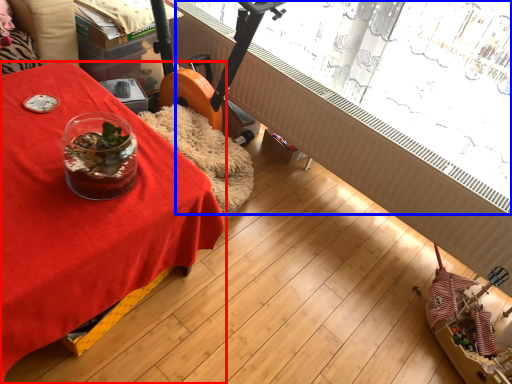
Question: Which object is closer to the camera taking this photo, table (highlighted by a red box) or bay window (highlighted by a blue box)?

Choices:
 (A) table
 (B) bay window

Answer: (A)